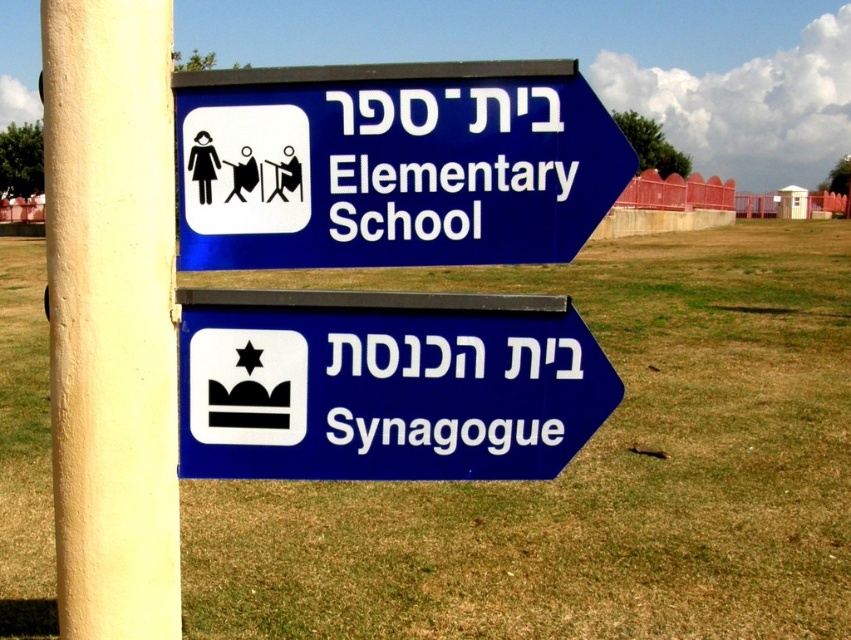
Question: Estimate the real-world distances between objects in this image. Which object is farther from the blue plastic sign at lower right?

Choices:
 (A) blue plastic elementary school sign at upper right
 (B) white textured pole at left

Answer: (B)

Question: Which of the following is the closest to the observer?

Choices:
 (A) white textured pole at left
 (B) blue plastic sign at lower right
 (C) blue plastic elementary school sign at upper right

Answer: (A)

Question: Is blue plastic elementary school sign at upper right above blue plastic sign at lower right?

Choices:
 (A) yes
 (B) no

Answer: (A)

Question: Which of the following is the closest to the observer?

Choices:
 (A) blue plastic elementary school sign at upper right
 (B) blue plastic sign at lower right
 (C) white textured pole at left

Answer: (C)

Question: In this image, where is blue plastic elementary school sign at upper right located relative to blue plastic sign at lower right?

Choices:
 (A) above
 (B) below

Answer: (A)

Question: From the image, what is the correct spatial relationship of blue plastic elementary school sign at upper right in relation to white textured pole at left?

Choices:
 (A) below
 (B) above

Answer: (B)